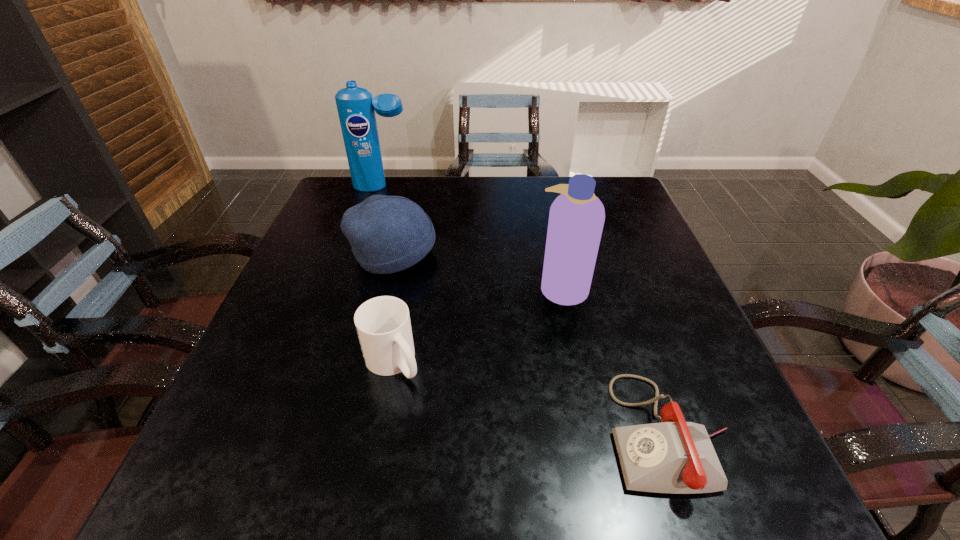
At what (x,y) coordinates should I click in order to perform the action: click on free space at the far edge of the desktop. Please return your answer as a coordinate pair (x, y). This screenshot has height=540, width=960. Looking at the image, I should click on 440,189.

Identify the location of blank space at the near edge of the desktop. (482, 474).

Locate an element on the screen. The width and height of the screenshot is (960, 540). free spot at the left edge of the desktop is located at coordinates (330, 237).

Where is `vacant space at the right edge of the desktop`? vacant space at the right edge of the desktop is located at coordinates (610, 253).

Where is `blank space at the near left corner of the desktop`? blank space at the near left corner of the desktop is located at coordinates (176, 490).

Where is `vacant area that lies between the second shortest object and the left shampoo`? The image size is (960, 540). vacant area that lies between the second shortest object and the left shampoo is located at coordinates (388, 274).

Find the location of a particular element. This screenshot has width=960, height=540. free space that is in between the mug and the shortest object is located at coordinates (531, 397).

Identify the location of empty space between the telephone and the fourth tallest object. (531, 397).

Image resolution: width=960 pixels, height=540 pixels. Find the location of `empty space between the farther shampoo and the shortest object`. empty space between the farther shampoo and the shortest object is located at coordinates (525, 309).

Find the location of a particular element. This screenshot has width=960, height=540. vacant space in between the farthest object and the nearer shampoo is located at coordinates (472, 237).